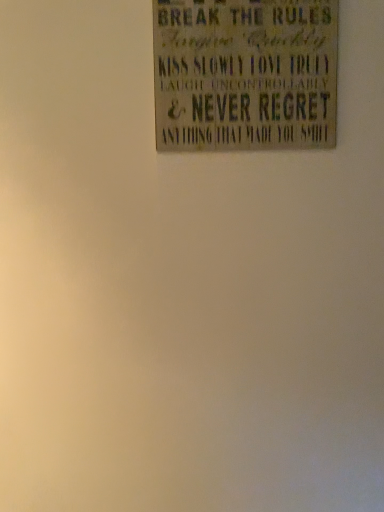
Image resolution: width=384 pixels, height=512 pixels. What do you see at coordinates (245, 74) in the screenshot?
I see `wooden signboard at upper center` at bounding box center [245, 74].

The height and width of the screenshot is (512, 384). Identify the location of wooden signboard at upper center. (245, 74).

You are a GUI agent. You are given a task and a screenshot of the screen. Output one action in this format:
    pyautogui.click(x=<x>, y=<y>)
    Task: Click on the wooden signboard at upper center
    
    Given the screenshot: What is the action you would take?
    pyautogui.click(x=245, y=74)